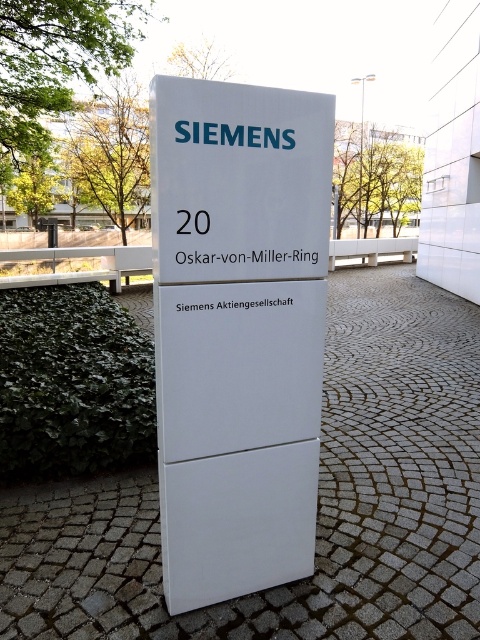
Is point (264, 132) closer to viewer compared to point (286, 90)?

Yes, it is.

Based on the photo, does white matte sign at center have a lesser height compared to white plastic sign at center?

No.

Does point (298, 195) lie behind point (302, 116)?

Yes, it is.

The height and width of the screenshot is (640, 480). What are the coordinates of `white matte sign at center` in the screenshot? It's located at (238, 330).